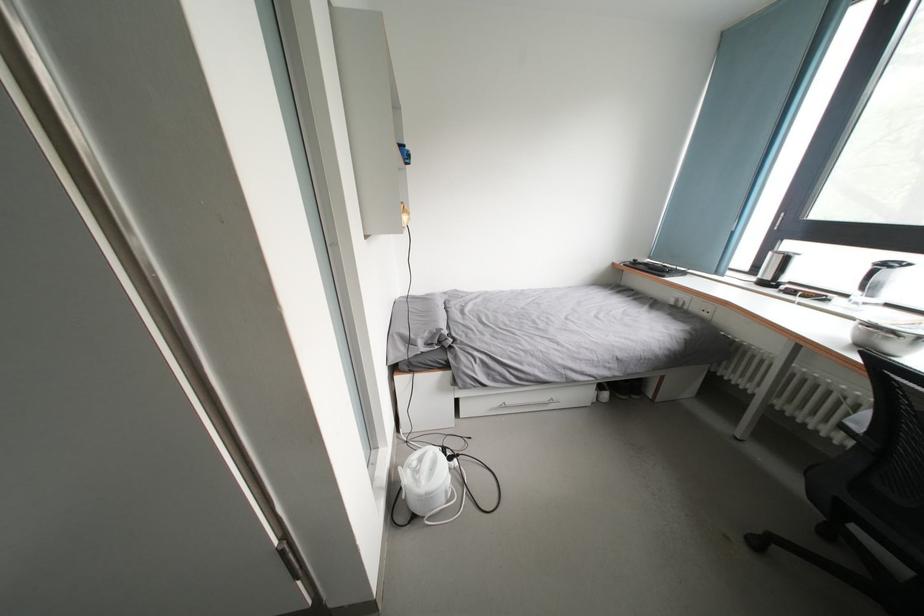
Locate an element on the screen. This screenshot has height=616, width=924. metal mixing bowl is located at coordinates (888, 334).